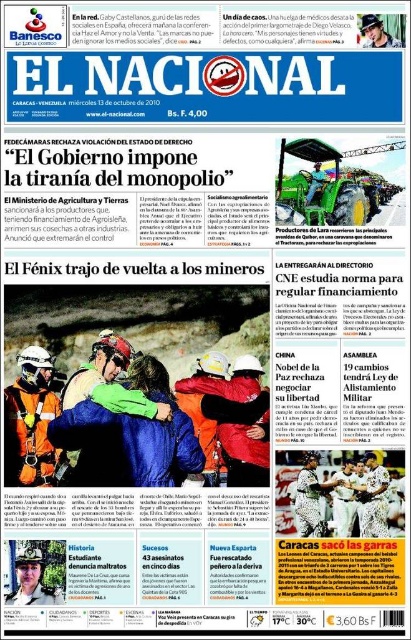
What is the relationship between the sizes of the orange reflective safety vest at left and the green fabric tractor at center in the newspaper image?

The orange reflective safety vest at left is larger in size than the green fabric tractor at center.

You are a delivery person who needs to deliver a package to the green fabric tractor at center. You are currently standing next to the orange reflective jacket at center. Which direction should you move to reach the tractor?

The orange reflective jacket at center is to the left of the green fabric tractor at center, so you should move to the right to reach the tractor.

You are a journalist examining the front page of the newspaper. You notice the matte black helmet at center and the green fabric tractor at center. Which object is taller in the image?

The matte black helmet at center is taller than the green fabric tractor at center according to the description.